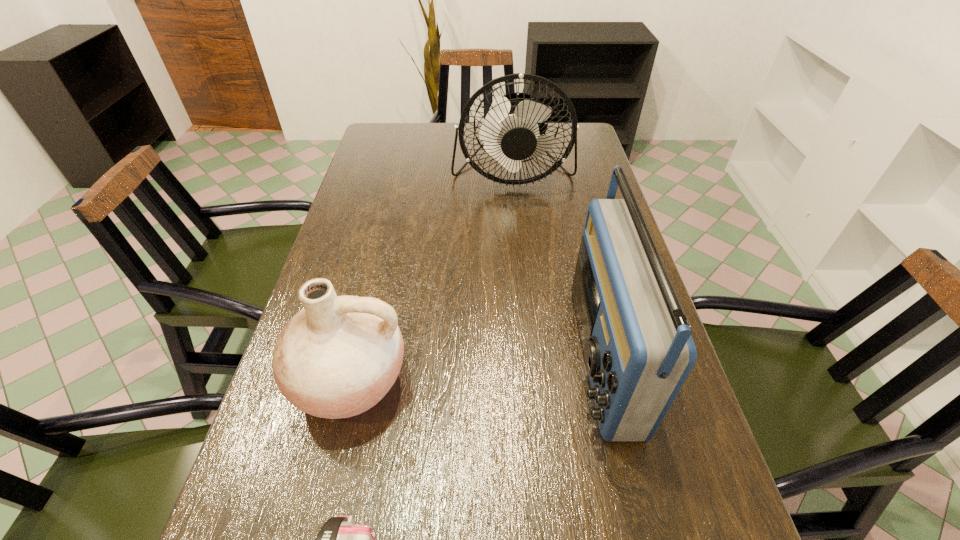
The height and width of the screenshot is (540, 960). I want to click on fan that is positioned at the right edge, so click(x=510, y=132).

The height and width of the screenshot is (540, 960). Find the location of `radio receiver that is positioned at the right edge`. radio receiver that is positioned at the right edge is located at coordinates (638, 350).

At what (x,y) coordinates should I click in order to perform the action: click on object at the far right corner. Please return your answer as a coordinate pair (x, y). The height and width of the screenshot is (540, 960). Looking at the image, I should click on (510, 132).

Find the location of `free space at the far edge of the desktop`. free space at the far edge of the desktop is located at coordinates coord(445,134).

In the image, there is a desktop. Identify the location of vacant space at the left edge. (279, 397).

I want to click on vacant space at the right edge of the desktop, so click(575, 244).

The width and height of the screenshot is (960, 540). I want to click on vacant region at the far left corner of the desktop, so click(x=398, y=143).

Where is `free space between the radio receiver and the third tallest object`? The image size is (960, 540). free space between the radio receiver and the third tallest object is located at coordinates (475, 368).

Where is `empty location between the fan and the second shortest object`? The image size is (960, 540). empty location between the fan and the second shortest object is located at coordinates (431, 276).

Where is `free space between the farthest object and the radio receiver`? free space between the farthest object and the radio receiver is located at coordinates click(557, 265).